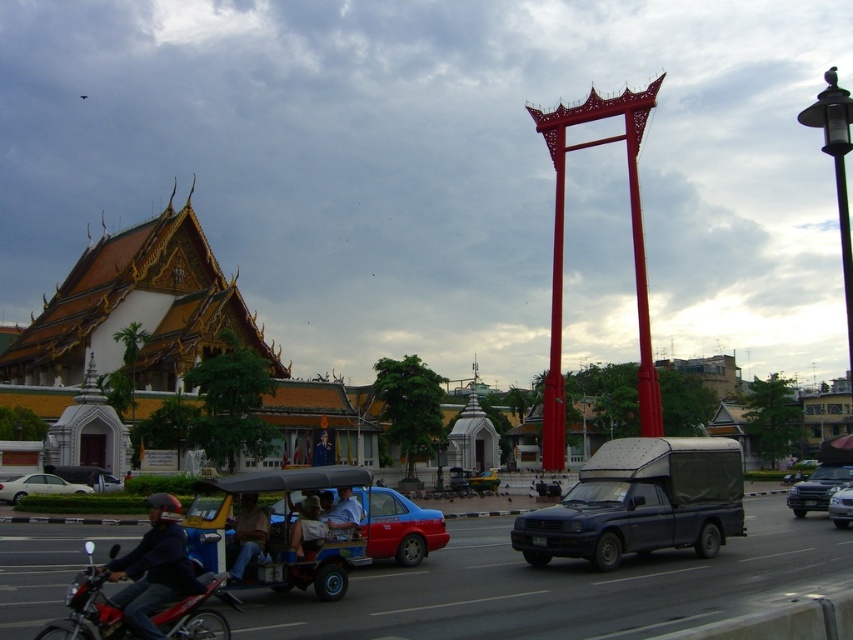
Question: Among these objects, which one is nearest to the camera?

Choices:
 (A) metallic silver pickup truck at center
 (B) metallic silver car at center
 (C) metallic blue taxi at center
 (D) white matte sedan at lower left

Answer: (C)

Question: Which point is farther to the camera?

Choices:
 (A) (161, 593)
 (B) (602, 477)

Answer: (B)

Question: Can you confirm if black metal/texture streetlamp at upper right is wider than light brown leather jacket at center?

Choices:
 (A) yes
 (B) no

Answer: (A)

Question: Which of the following is the closest to the observer?

Choices:
 (A) coord(163,634)
 (B) coord(91,488)
 (C) coord(305,522)
 (D) coord(844,115)

Answer: (A)

Question: Can you confirm if metallic blue taxi at center is smaller than metallic silver pickup truck at center?

Choices:
 (A) no
 (B) yes

Answer: (B)

Question: Can you confirm if denim jacket at lower center is smaller than light brown leather jacket at center?

Choices:
 (A) yes
 (B) no

Answer: (A)